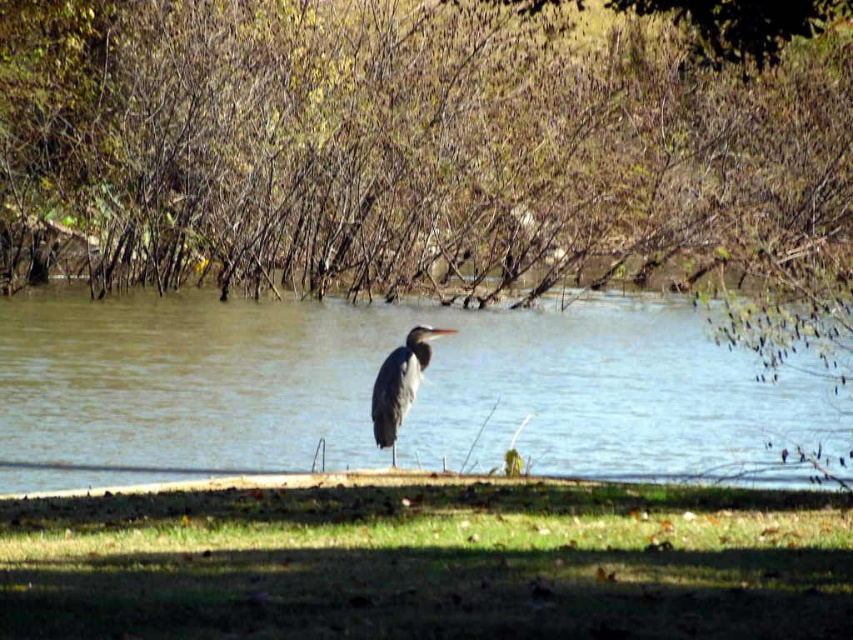
Question: Which point appears closest to the camera in this image?

Choices:
 (A) (234, 545)
 (B) (647, 412)
 (C) (426, 336)

Answer: (A)

Question: Which of the following is the farthest from the observer?

Choices:
 (A) green grass at lower center
 (B) clear water at center
 (C) gray matte bird at center

Answer: (C)

Question: Can you confirm if green grass at lower center is positioned to the left of clear water at center?

Choices:
 (A) no
 (B) yes

Answer: (A)

Question: Which of the following is the closest to the observer?

Choices:
 (A) (416, 348)
 (B) (360, 444)
 (C) (527, 524)

Answer: (C)

Question: Does green grass at lower center come in front of clear water at center?

Choices:
 (A) yes
 (B) no

Answer: (A)

Question: Where is green grass at lower center located in relation to clear water at center in the image?

Choices:
 (A) below
 (B) above

Answer: (A)